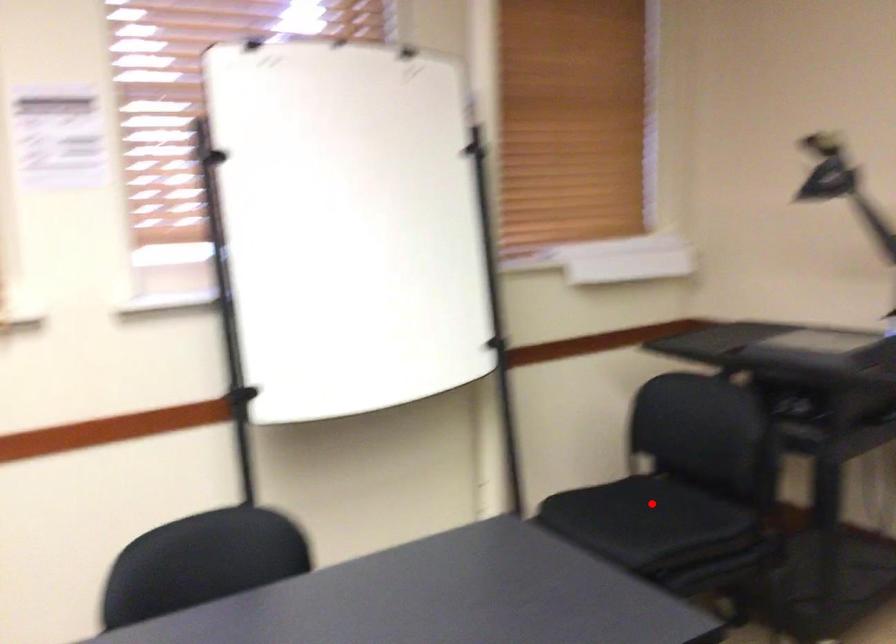
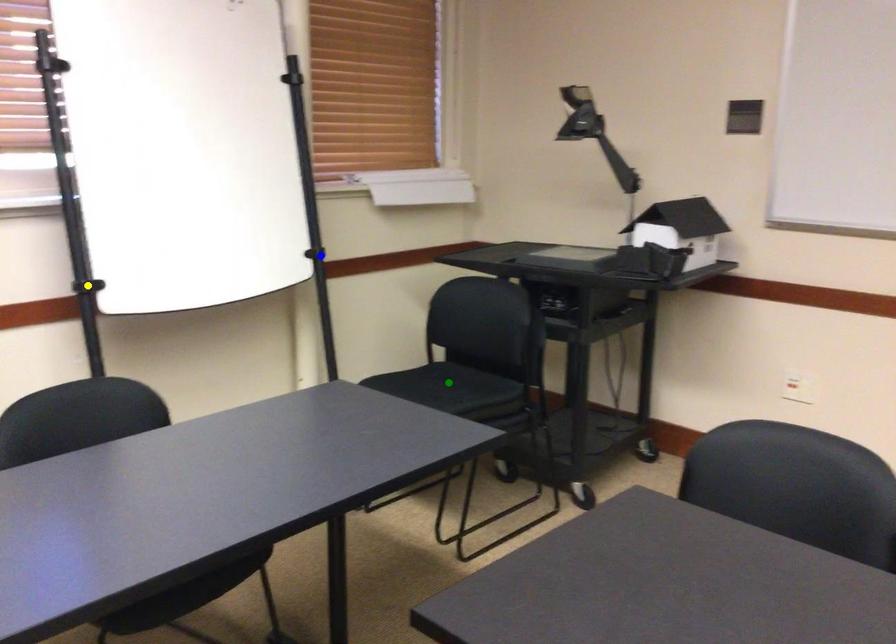
Question: I am providing you with two images of the same scene from different viewpoints. A red point is marked on the first image. You are given multiple points on the second image. Which spot in image 2 lines up with the point in image 1?

Choices:
 (A) yellow point
 (B) green point
 (C) blue point

Answer: (B)